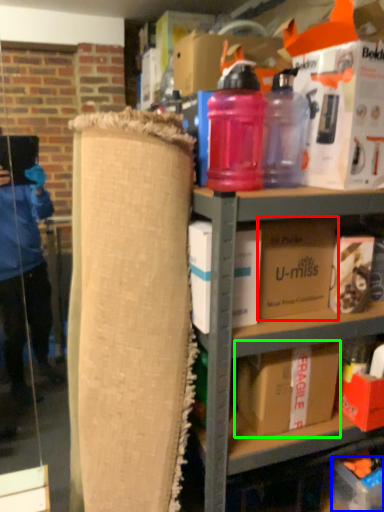
Question: Which object is the farthest from box (highlighted by a red box)? Choose among these: cardboard box (highlighted by a blue box) or box (highlighted by a green box).

Choices:
 (A) cardboard box
 (B) box

Answer: (A)